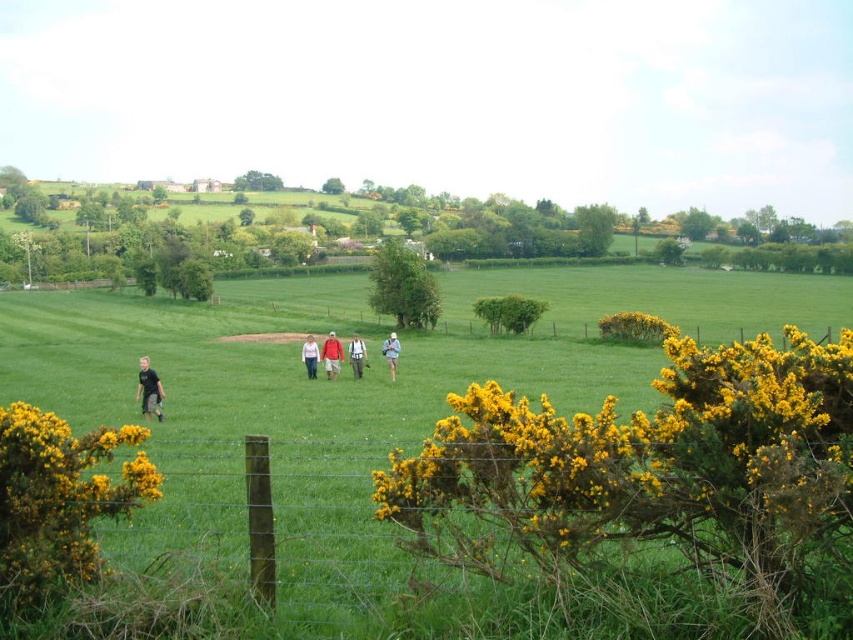
In the scene shown: You are standing at the center of the field in the image. You see a person with light brown hair at lower left. In which direction should you walk to reach them?

You should walk towards the lower left direction to reach the light brown hair at lower left.